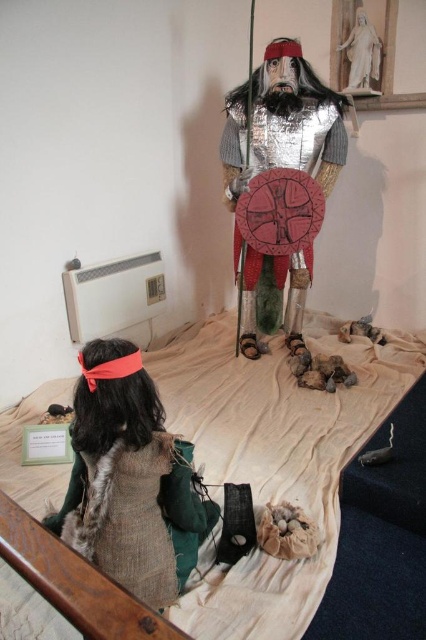
Does white fabric bed at center have a greater width compared to shiny silver armor at center?

Yes.

What are the coordinates of `white fabric bed at center` in the screenshot? It's located at (273, 458).

Locate an element on the screen. The width and height of the screenshot is (426, 640). white fabric bed at center is located at coordinates (273, 458).